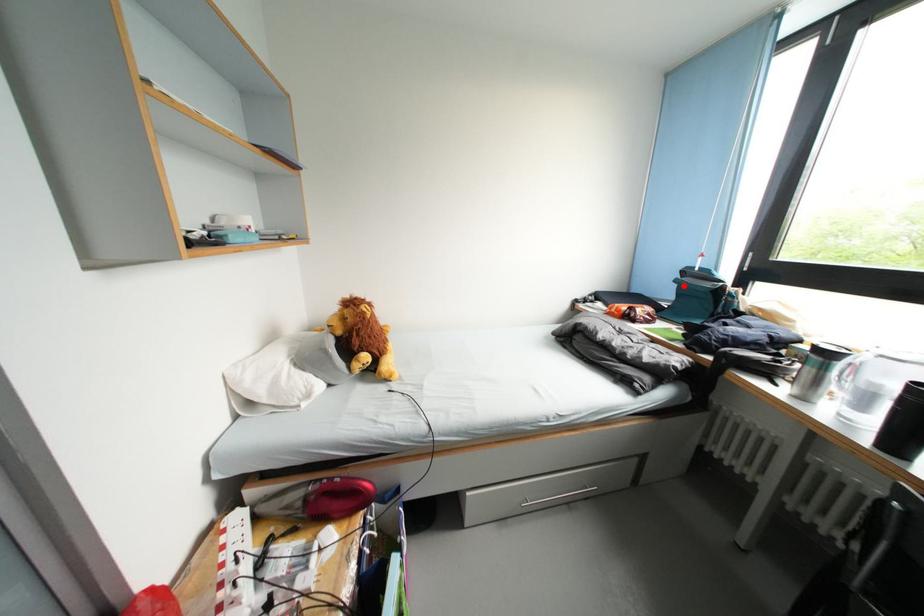
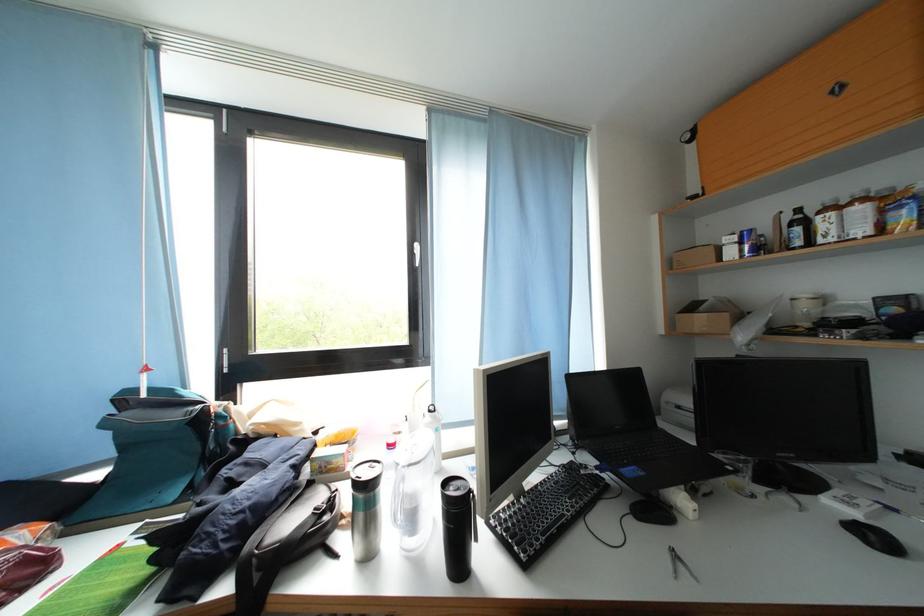
Question: I am providing you with two images of the same scene from different viewpoints. A red point is marked on the first image. Is the red point's position out of view in image 2?

Choices:
 (A) Yes
 (B) No

Answer: (B)